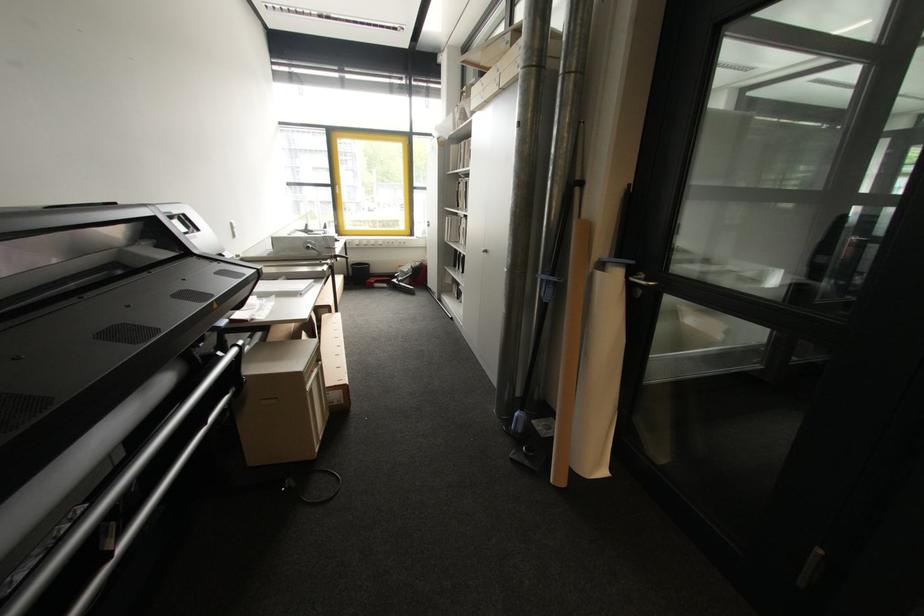
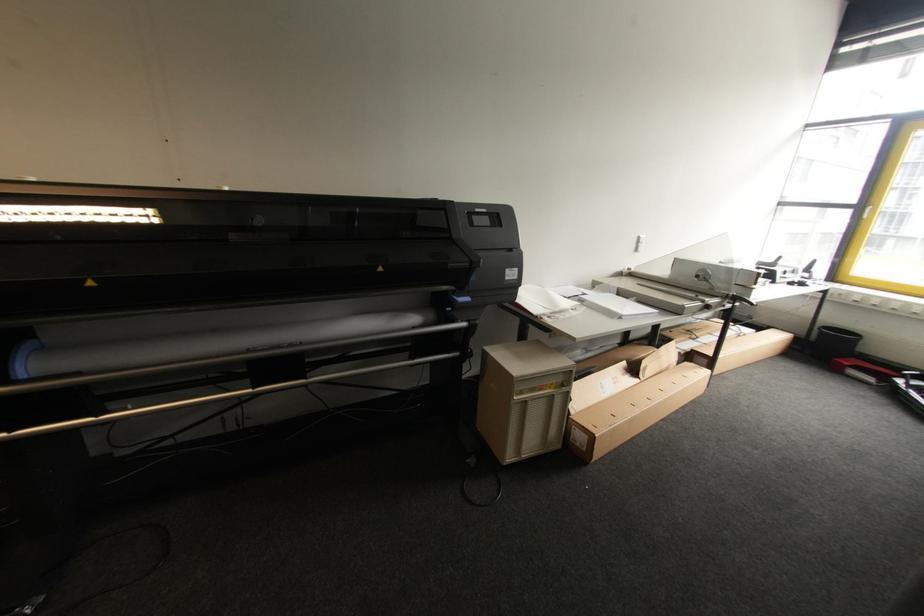
Question: The camera is either moving clockwise (left) or counter-clockwise (right) around the object. The first image is from the beginning of the video and the second image is from the end. Is the camera moving left or right when shooting the video?

Choices:
 (A) Left
 (B) Right

Answer: (B)